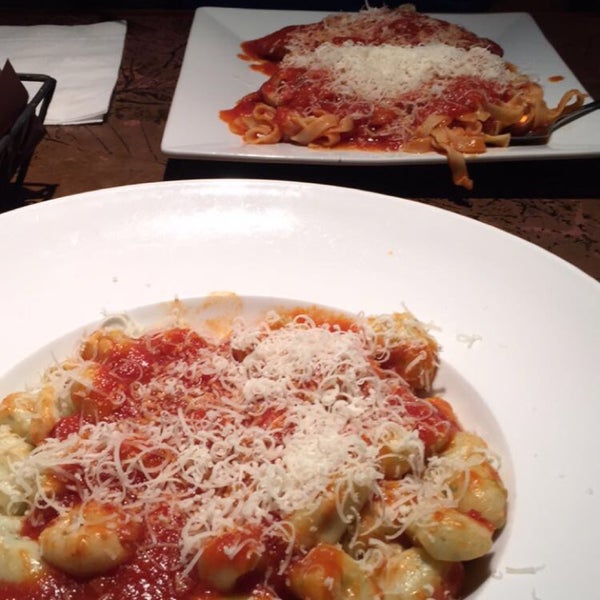
Image resolution: width=600 pixels, height=600 pixels. I want to click on plate, so click(56, 247).